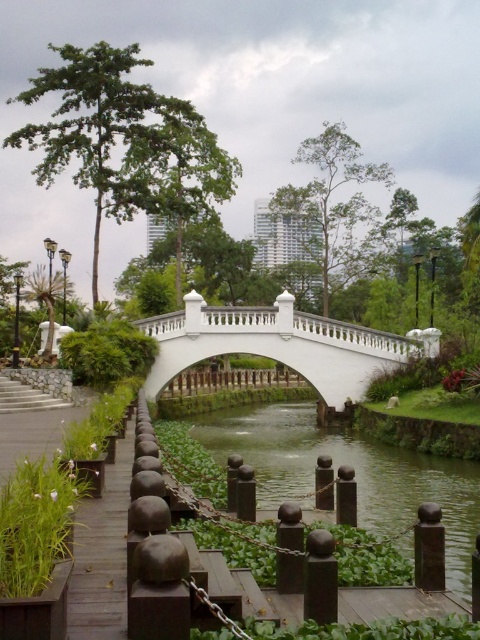
Question: Does green mossy river at center have a larger size compared to wooden planks at lower left?

Choices:
 (A) no
 (B) yes

Answer: (B)

Question: Which point is farther from the camera taking this photo?

Choices:
 (A) (393, 451)
 (B) (354, 384)

Answer: (B)

Question: Does green mossy river at center appear under wooden planks at lower left?

Choices:
 (A) no
 (B) yes

Answer: (B)

Question: Considering the real-world distances, which object is closest to the wooden planks at lower left?

Choices:
 (A) green mossy river at center
 (B) white marble bridge at center

Answer: (A)

Question: Among these points, which one is nearest to the camera?

Choices:
 (A) (117, 634)
 (B) (477, 513)

Answer: (A)

Question: Is green mossy river at center above white marble bridge at center?

Choices:
 (A) no
 (B) yes

Answer: (A)